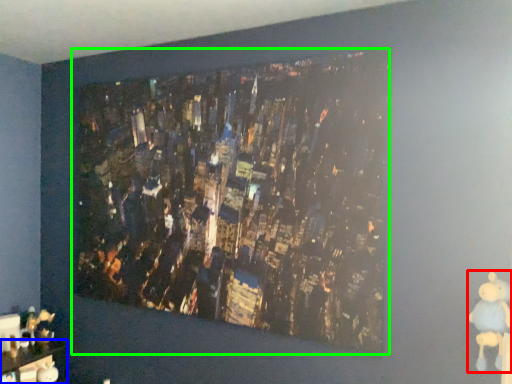
Question: Which is farther away from toy (highlighted by a red box)? furniture (highlighted by a blue box) or picture frame (highlighted by a green box)?

Choices:
 (A) furniture
 (B) picture frame

Answer: (A)